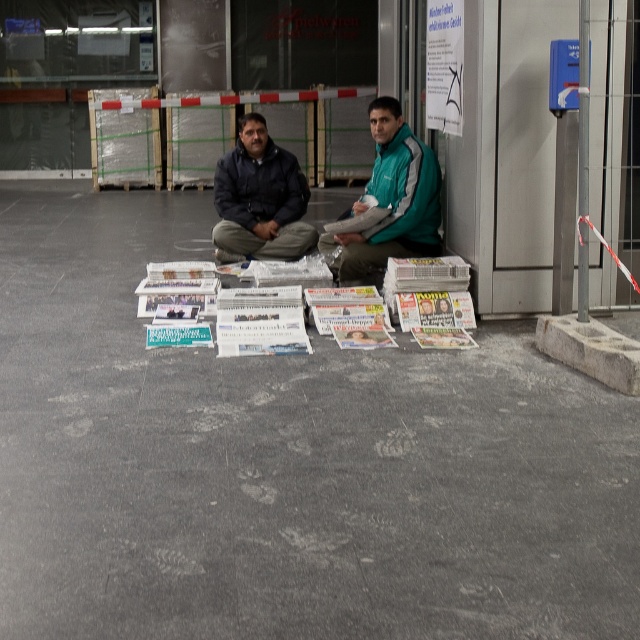
Between gray concrete floor at center and white glossy magazines at center, which one is positioned higher?

white glossy magazines at center

The image size is (640, 640). Identify the location of gray concrete floor at center. pos(285,461).

Is point (100, 308) closer to camera compared to point (262, 291)?

That is False.

The width and height of the screenshot is (640, 640). I want to click on gray concrete floor at center, so click(x=285, y=461).

Who is more forward, (355,413) or (272,244)?

Point (355,413) is in front.

Image resolution: width=640 pixels, height=640 pixels. What do you see at coordinates (285, 461) in the screenshot?
I see `gray concrete floor at center` at bounding box center [285, 461].

At what (x,y) coordinates should I click in order to perform the action: click on gray concrete floor at center. Please return your answer as a coordinate pair (x, y). This screenshot has height=640, width=640. Looking at the image, I should click on (285, 461).

Does point (193, 316) lie behind point (401, 204)?

No, (193, 316) is in front of (401, 204).

Locate an element on the screen. The width and height of the screenshot is (640, 640). white glossy magazines at center is located at coordinates (232, 310).

Does point (348, 289) come farther from viewer compared to point (392, 109)?

No.

I want to click on white glossy magazines at center, so click(x=232, y=310).